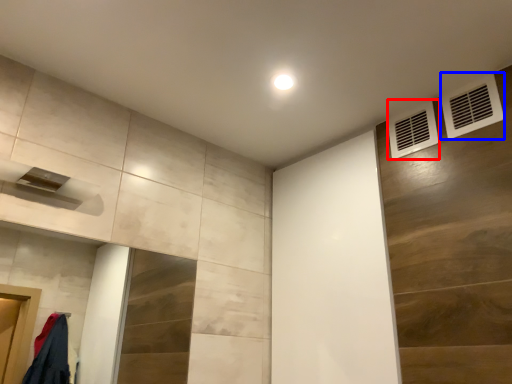
Question: Which object appears closest to the camera in this image, air conditioning (highlighted by a red box) or air conditioning (highlighted by a blue box)?

Choices:
 (A) air conditioning
 (B) air conditioning

Answer: (B)